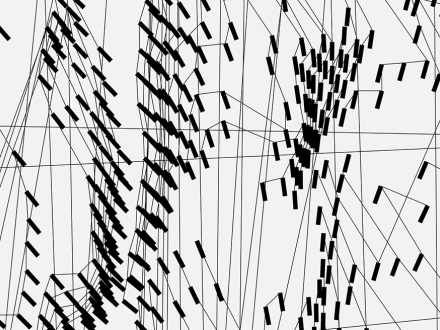
Where is `wires`? The width and height of the screenshot is (440, 330). wires is located at coordinates (246, 17), (256, 18).